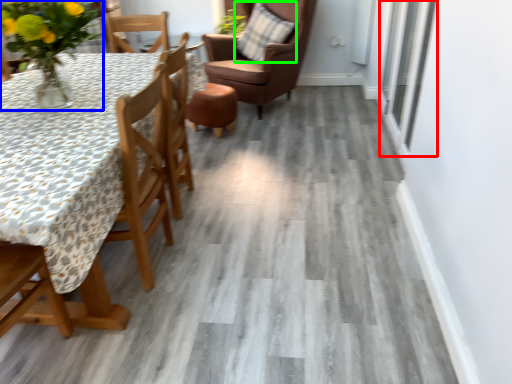
Question: Based on their relative distances, which object is farther from window (highlighted by a red box)? Choose from floral arrangement (highlighted by a blue box) and pillow (highlighted by a green box).

Choices:
 (A) floral arrangement
 (B) pillow

Answer: (A)